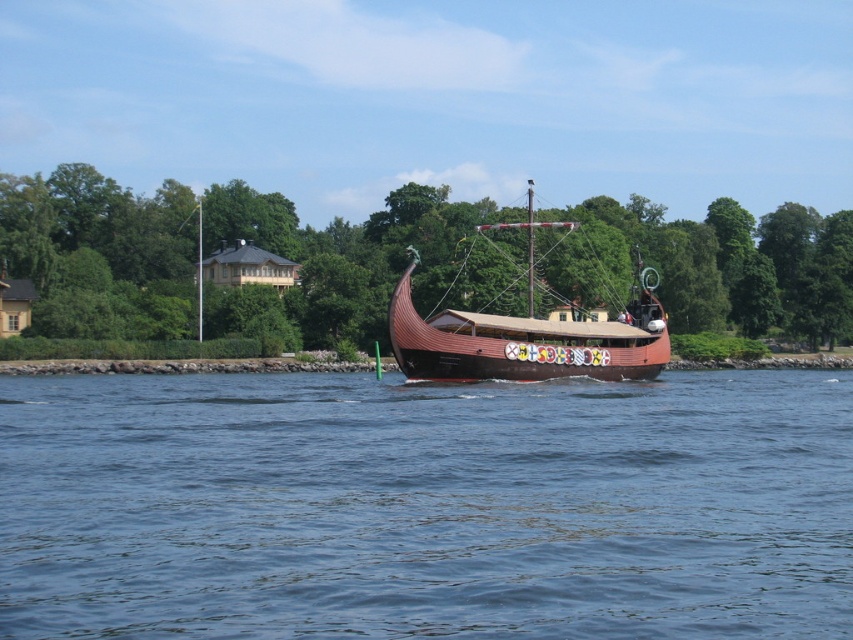
Which is behind, point (825, 595) or point (517, 330)?

Point (517, 330)

Is point (398, 404) farther from viewer compared to point (573, 336)?

No, (398, 404) is in front of (573, 336).

Locate an element on the screen. The image size is (853, 640). blue water at center is located at coordinates point(425,506).